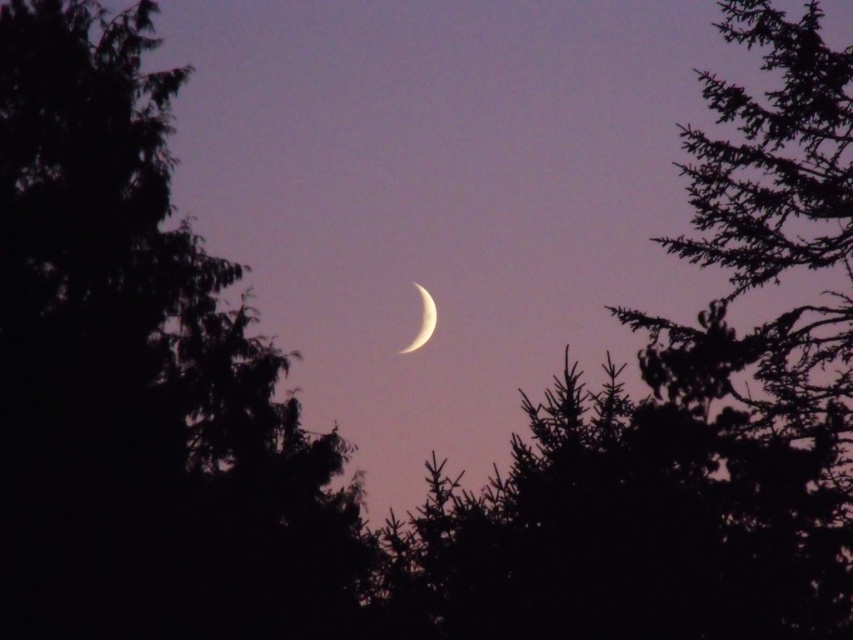
In the scene shown: You are an astronomer observing the night sky. You notice a green leafy tree at center and a white glossy crescent moon at center. How far apart are these two celestial objects from each other?

The green leafy tree at center and the white glossy crescent moon at center are 57.91 meters apart from each other.

Based on the photo, you are standing at the origin point of the coordinate system. You want to walk towards the dark green leafy tree at center. What direction should you head in?

The dark green leafy tree at center is located at coordinate point 0.591 on the x axis and 0.165 on the y axis. Since you are at the origin, you should move in the positive x and positive y direction to reach it.